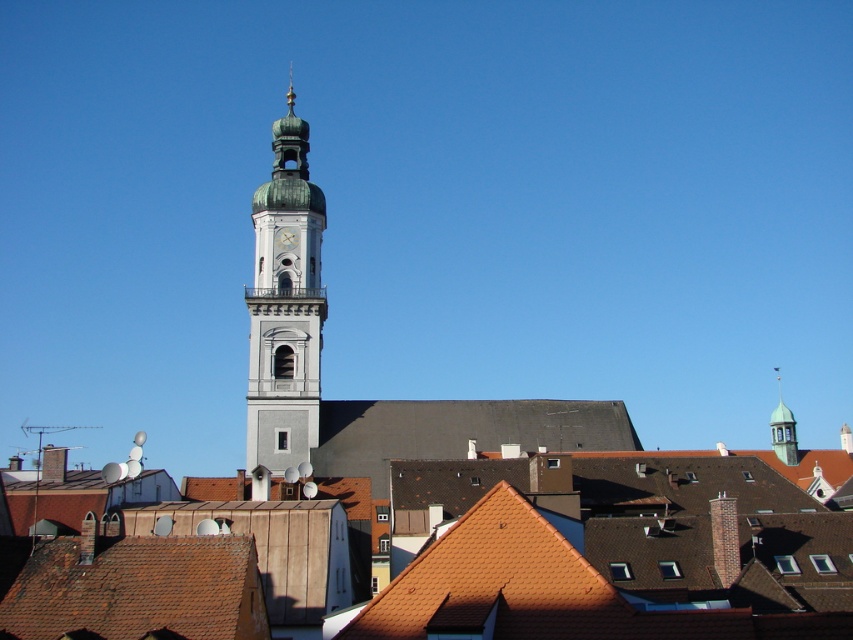
Can you confirm if green polished dome at center is shorter than green copper bell tower at upper right?

Incorrect, green polished dome at center's height does not fall short of green copper bell tower at upper right's.

Is green polished dome at center smaller than green copper bell tower at upper right?

Incorrect, green polished dome at center is not smaller in size than green copper bell tower at upper right.

Identify the location of green polished dome at center. (285, 305).

Identify the location of green polished dome at center. This screenshot has height=640, width=853. (285, 305).

Can you confirm if green polished dome at center is shorter than white glossy clock at center?

No, green polished dome at center is not shorter than white glossy clock at center.

Who is more distant from viewer, (260, 284) or (289, 234)?

The point (289, 234) is behind.

This screenshot has height=640, width=853. What are the coordinates of `green polished dome at center` in the screenshot? It's located at (285, 305).

From the picture: Is green copper bell tower at upper right behind white glossy clock at center?

That is False.

Which is behind, point (772, 410) or point (289, 244)?

Point (772, 410)

The image size is (853, 640). Identify the location of green copper bell tower at upper right. (782, 429).